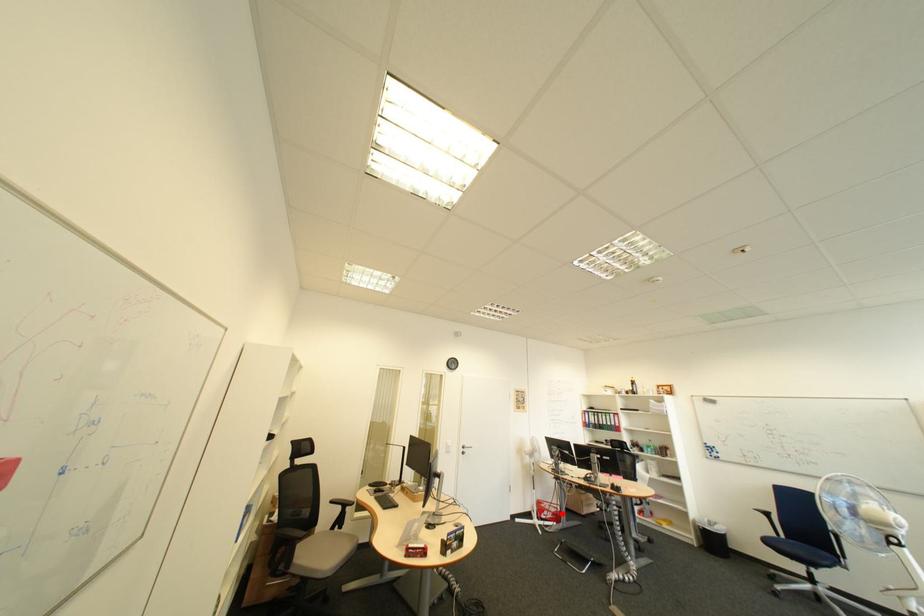
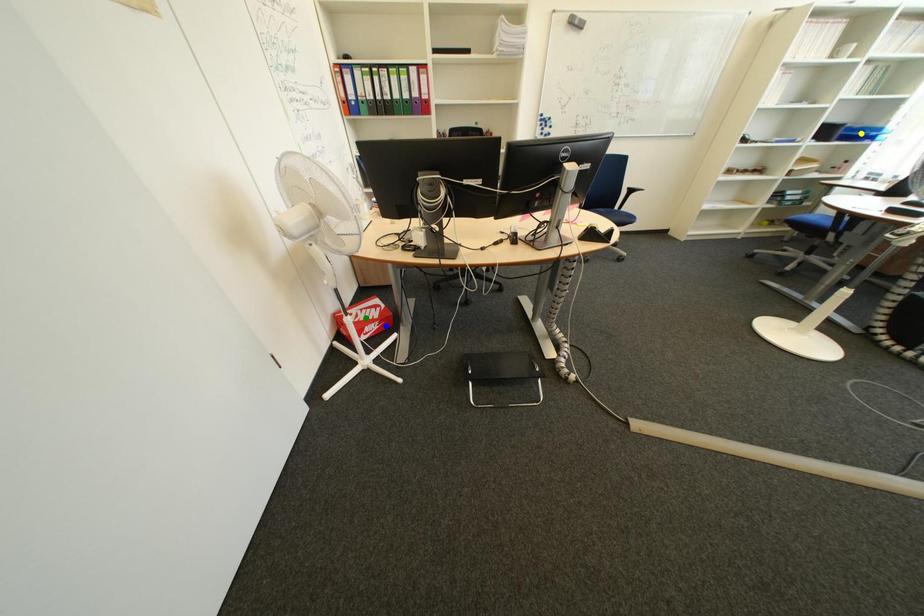
Question: I am providing you with two images of the same scene from different viewpoints. A red point is marked on the first image. You are given multiple points on the second image. Which mark in image 2 goes with the point in image 1?

Choices:
 (A) green point
 (B) blue point
 (C) yellow point

Answer: (B)